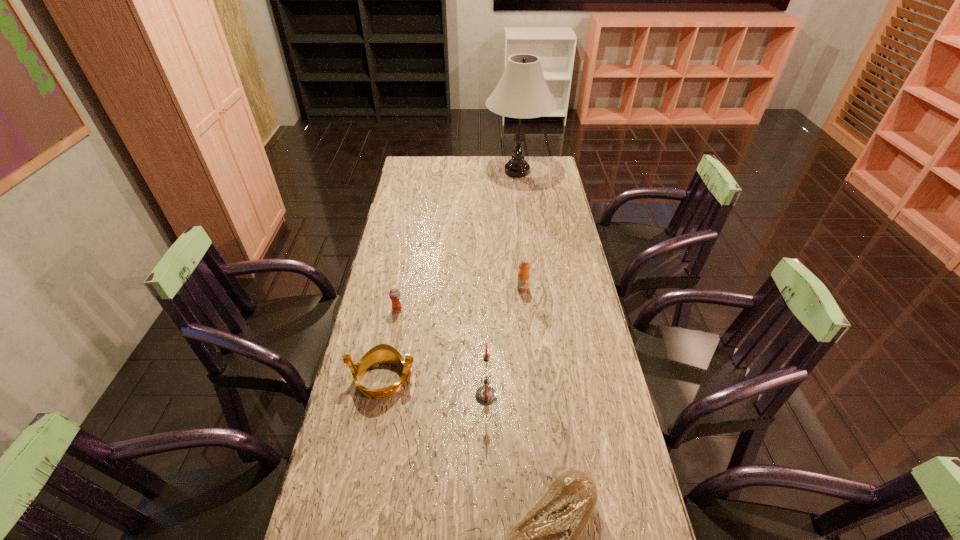
At what (x,y) coordinates should I click in order to perform the action: click on free space at the left edge. Please return your answer as a coordinate pair (x, y). The image size is (960, 540). Looking at the image, I should click on (372, 292).

This screenshot has height=540, width=960. In the image, there is a desktop. In order to click on vacant space at the right edge in this screenshot , I will do `click(538, 215)`.

Where is `blank space at the far left corner`? The image size is (960, 540). blank space at the far left corner is located at coordinates (408, 160).

Identify the location of free space at the far right corner. (552, 167).

I want to click on free spot between the nearer orange juice and the tallest object, so [457, 241].

You are a GUI agent. You are given a task and a screenshot of the screen. Output one action in this format:
    pyautogui.click(x=<x>, y=<y>)
    Task: Click on the vacant space that's between the second farthest object and the farthest object
    This screenshot has width=960, height=540.
    Given the screenshot: What is the action you would take?
    pyautogui.click(x=520, y=230)

You are a GUI agent. You are given a task and a screenshot of the screen. Output one action in this format:
    pyautogui.click(x=<x>, y=<y>)
    Task: Click on the vacant space that is in between the third tallest object and the tiara
    Image resolution: width=960 pixels, height=540 pixels.
    Given the screenshot: What is the action you would take?
    pyautogui.click(x=453, y=334)

Find the location of a particular element. This screenshot has width=960, height=540. empty space between the lamp and the right orange juice is located at coordinates (520, 230).

Locate an element on the screen. free space that is in between the tiara and the tallest object is located at coordinates (450, 275).

What are the coordinates of `free area in between the tiara and the right orange juice` in the screenshot? It's located at (453, 334).